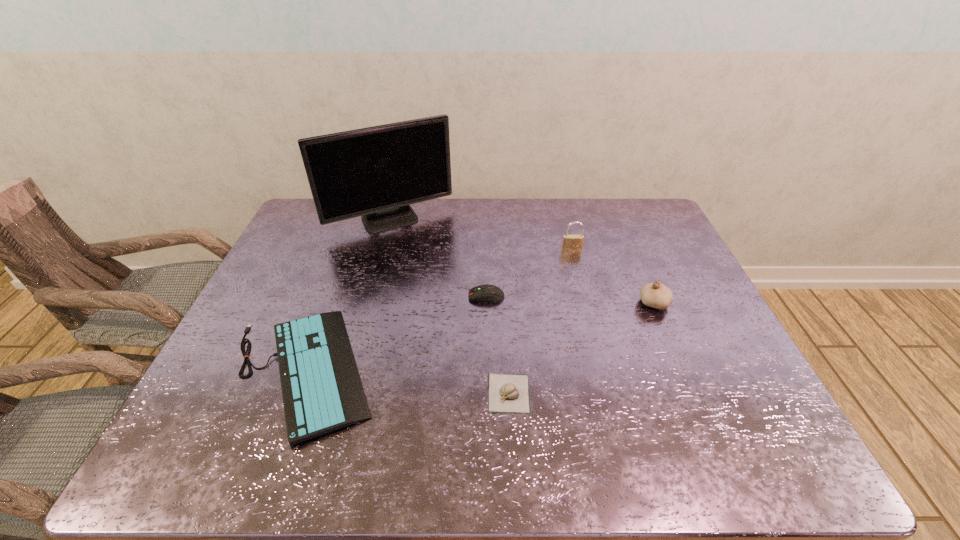
The height and width of the screenshot is (540, 960). Identify the location of object that is the third nearest to the shorter garlic. (656, 295).

At what (x,y) coordinates should I click in order to perform the action: click on object that stands as the fifth closest to the second tallest object. Please return your answer as a coordinate pair (x, y). The width and height of the screenshot is (960, 540). Looking at the image, I should click on (322, 391).

Locate an element on the screen. vacant area that satisfies the following two spatial constraints: 1. on the front-facing side of the rightmost object; 2. on the right side of the fifth shortest object is located at coordinates [585, 303].

Find the location of a particular element. The height and width of the screenshot is (540, 960). vacant region that satisfies the following two spatial constraints: 1. on the button of the computer equipment; 2. on the back side of the shorter garlic is located at coordinates (488, 393).

Image resolution: width=960 pixels, height=540 pixels. I want to click on free spot that satisfies the following two spatial constraints: 1. on the front-facing side of the second object from right to left; 2. on the button of the computer equipment, so click(584, 296).

This screenshot has height=540, width=960. Find the location of `vacant space that satisfies the following two spatial constraints: 1. on the button of the fourth tallest object; 2. on the back side of the farther garlic`. vacant space that satisfies the following two spatial constraints: 1. on the button of the fourth tallest object; 2. on the back side of the farther garlic is located at coordinates (487, 303).